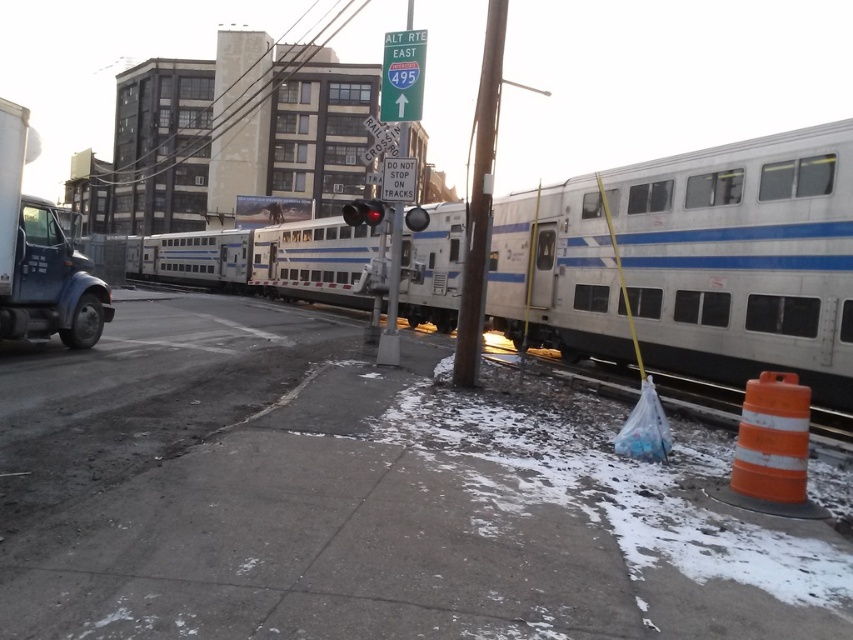
Is silver metallic train at center to the left of smooth wooden pole at center from the viewer's perspective?

Correct, you'll find silver metallic train at center to the left of smooth wooden pole at center.

Between silver metallic train at center and smooth wooden pole at center, which one has more height?

With more height is smooth wooden pole at center.

Measure the distance between point (x=578, y=216) and camera.

Point (x=578, y=216) is 34.65 feet away from camera.

Locate an element on the screen. This screenshot has width=853, height=640. silver metallic train at center is located at coordinates (743, 259).

Can you confirm if orange reflective cone at lower right is wider than smooth wooden pole at center?

Incorrect, orange reflective cone at lower right's width does not surpass smooth wooden pole at center's.

Can you confirm if orange reflective cone at lower right is shorter than smooth wooden pole at center?

Yes.

Does point (776, 497) come closer to viewer compared to point (463, 317)?

Yes, it is.

What are the coordinates of `orange reflective cone at lower right` in the screenshot? It's located at (772, 449).

Does silver metallic train at center have a lesser width compared to orange reflective cone at lower right?

Incorrect, silver metallic train at center's width is not less than orange reflective cone at lower right's.

Between silver metallic train at center and orange reflective cone at lower right, which one appears on the right side from the viewer's perspective?

From the viewer's perspective, orange reflective cone at lower right appears more on the right side.

Is point (631, 296) behind point (769, 460)?

Yes, point (631, 296) is farther from viewer.

Locate an element on the screen. This screenshot has height=640, width=853. silver metallic train at center is located at coordinates (743, 259).